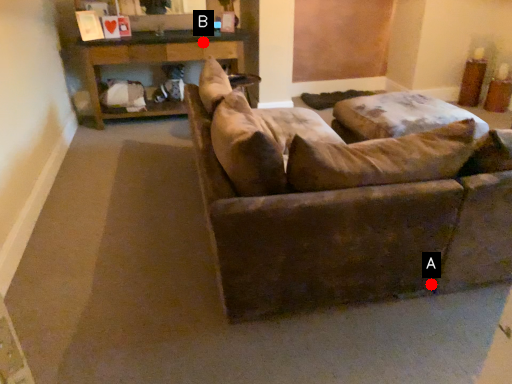
Question: Two points are circled on the image, labeled by A and B beside each circle. Which point appears closest to the camera in this image?

Choices:
 (A) A is closer
 (B) B is closer

Answer: (A)